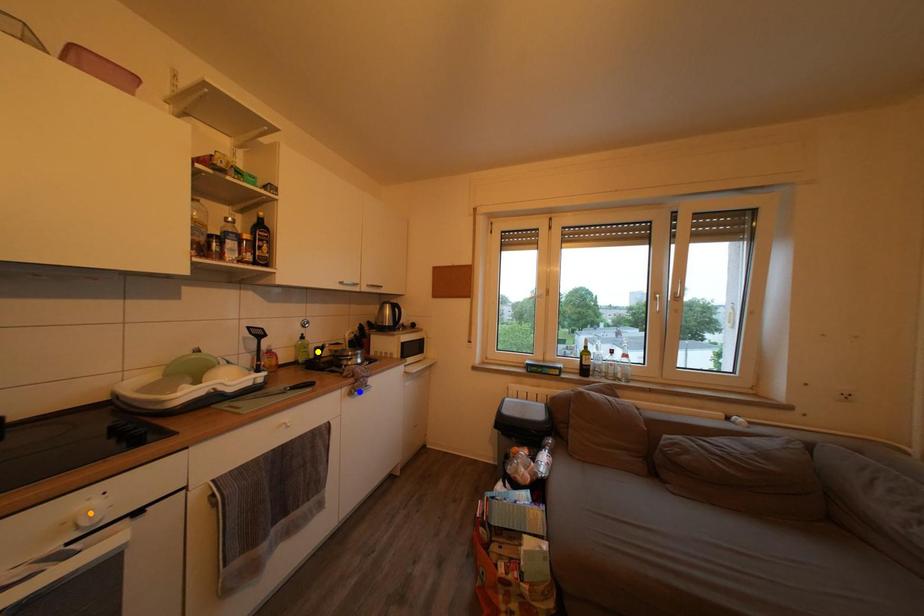
Looking at this image, order these from nearest to farthest:
- yellow point
- orange point
- blue point

orange point
blue point
yellow point